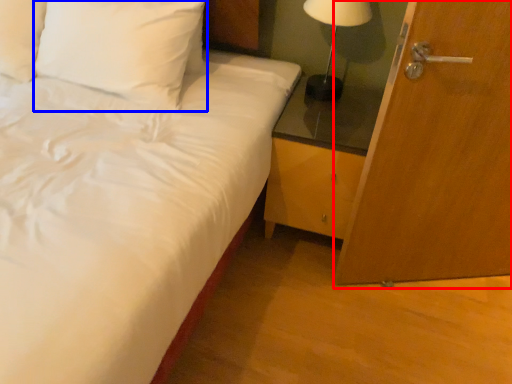
Question: Which object appears closest to the camera in this image, door (highlighted by a red box) or pillow (highlighted by a blue box)?

Choices:
 (A) door
 (B) pillow

Answer: (A)